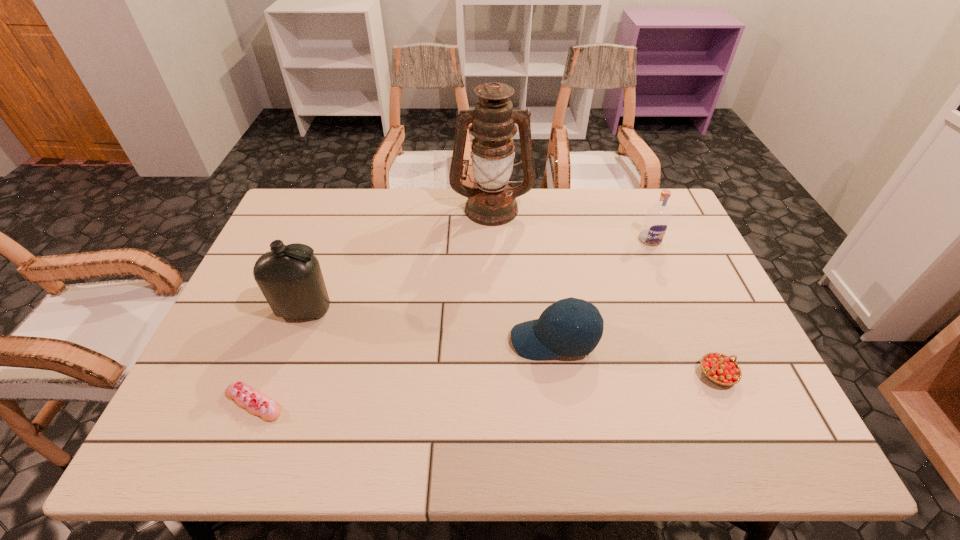
This screenshot has width=960, height=540. Find the location of `eclair situated at the left edge`. eclair situated at the left edge is located at coordinates (247, 397).

Find the location of a particular element. The width and height of the screenshot is (960, 540). vodka present at the right edge is located at coordinates (656, 221).

At what (x,y) coordinates should I click in order to perform the action: click on strawberry at the right edge. Please return your answer as a coordinate pair (x, y). The image size is (960, 540). Looking at the image, I should click on (720, 369).

Locate an element on the screen. The width and height of the screenshot is (960, 540). object located in the near left corner section of the desktop is located at coordinates (247, 397).

Locate an element on the screen. The width and height of the screenshot is (960, 540). object at the far right corner is located at coordinates (656, 221).

Locate an element on the screen. This screenshot has width=960, height=540. free spot at the far edge of the desktop is located at coordinates (557, 213).

Locate an element on the screen. This screenshot has width=960, height=540. vacant space at the near edge is located at coordinates (412, 431).

Where is `free region at the right edge`? This screenshot has height=540, width=960. free region at the right edge is located at coordinates (695, 329).

Find the location of a particular element. The width and height of the screenshot is (960, 540). vacant position at the far left corner of the desktop is located at coordinates click(x=291, y=198).

Where is `free space that is in between the fourth tallest object and the second shortest object`? The height and width of the screenshot is (540, 960). free space that is in between the fourth tallest object and the second shortest object is located at coordinates (636, 357).